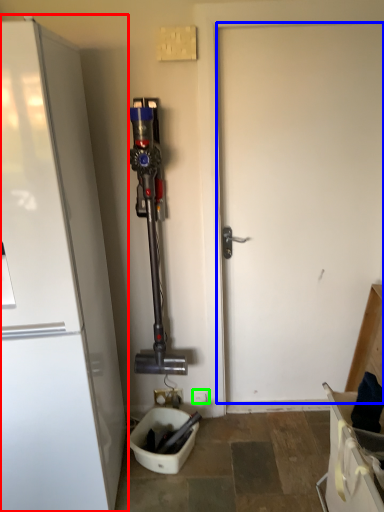
Question: Which object is positioned closest to refrigerator (highlighted by a red box)? Select from door (highlighted by a blue box) and electric outlet (highlighted by a green box).

Choices:
 (A) door
 (B) electric outlet

Answer: (A)